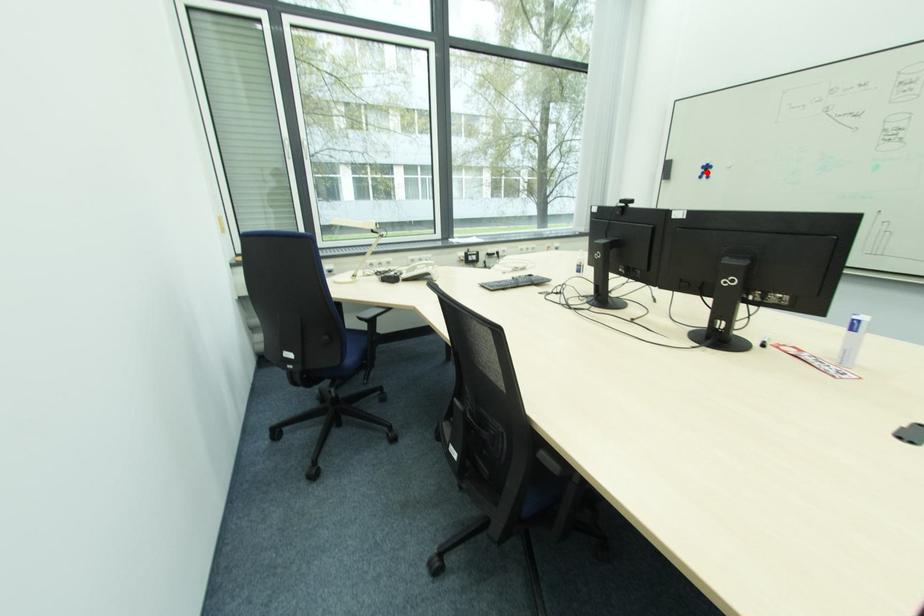
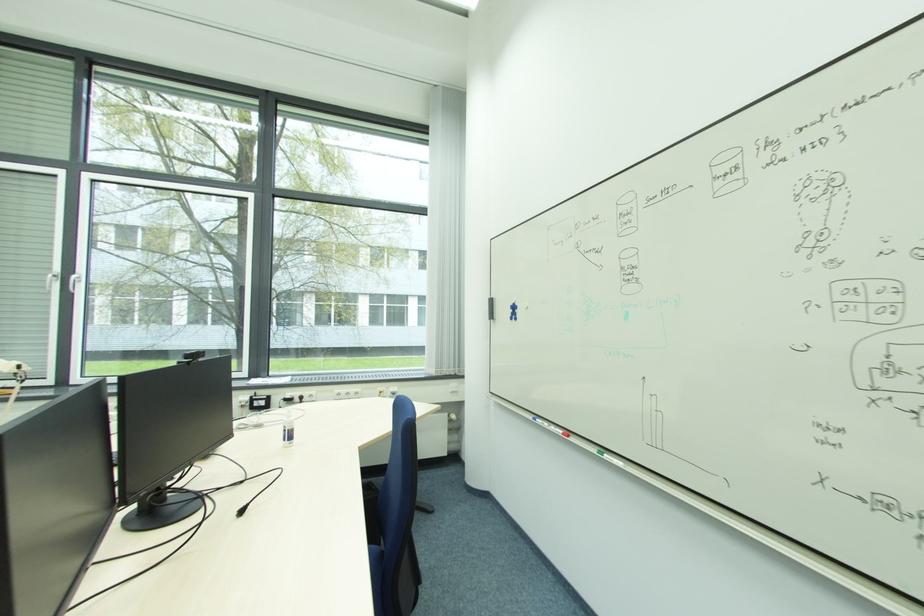
Locate, in the second image, the point that corresponds to the highlighted location in the first image.

(515, 313)